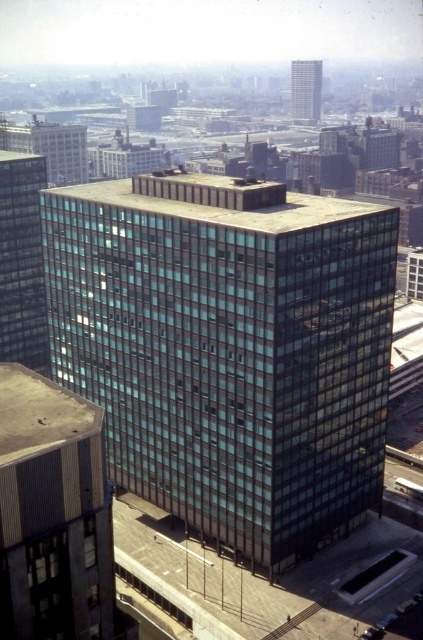
You are standing on the rooftop of the glassy black building at center and want to locate the tallest building in the city. Based on the image, which direction should you look to find it?

The tallest building is to the left of the glassy black building at center.

From the picture: You are an urban planner assessing the city layout. You need to determine which building occupies more horizontal space. Based on the image, which building has a greater width between the glassy black building at center and the glassy reflective building at left?

The glassy black building at center has a greater width than the glassy reflective building at left.

You are standing on a nearby rooftop and want to take a photo of the glassy black building at center and the glassy reflective skyscraper at upper center. Which building should you focus on first to ensure both are in the frame?

You should focus on the glassy reflective skyscraper at upper center first because it is farther away from you than the glassy black building at center, allowing you to adjust the camera to include both in the frame.